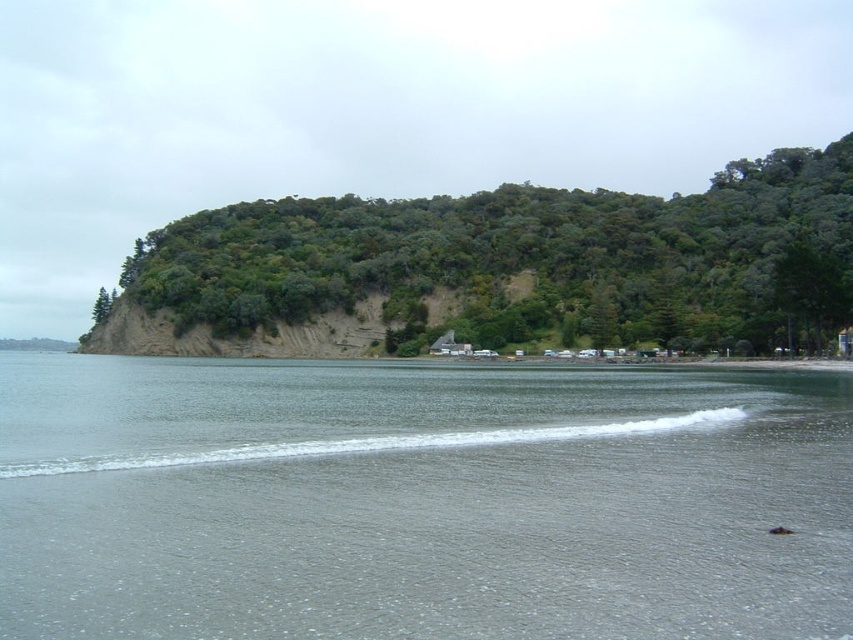
Question: Is gray water at lower center wider than green leafy hillside at upper center?

Choices:
 (A) yes
 (B) no

Answer: (B)

Question: Among these points, which one is nearest to the camera?

Choices:
 (A) (583, 266)
 (B) (508, 506)

Answer: (B)

Question: Is gray water at lower center below green leafy hillside at upper center?

Choices:
 (A) yes
 (B) no

Answer: (A)

Question: Is gray water at lower center to the right of green leafy hillside at upper center from the viewer's perspective?

Choices:
 (A) no
 (B) yes

Answer: (A)